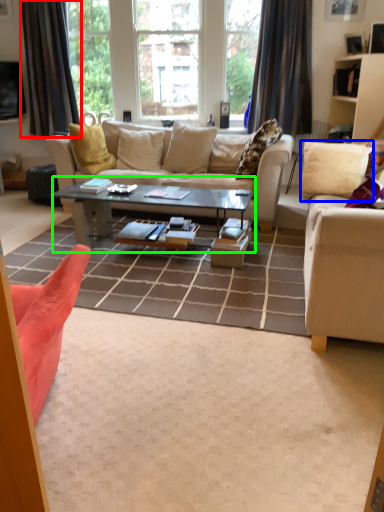
Question: Estimate the real-world distances between objects in this image. Which object is closer to curtain (highlighted by a red box), pillow (highlighted by a blue box) or coffee table (highlighted by a green box)?

Choices:
 (A) pillow
 (B) coffee table

Answer: (B)